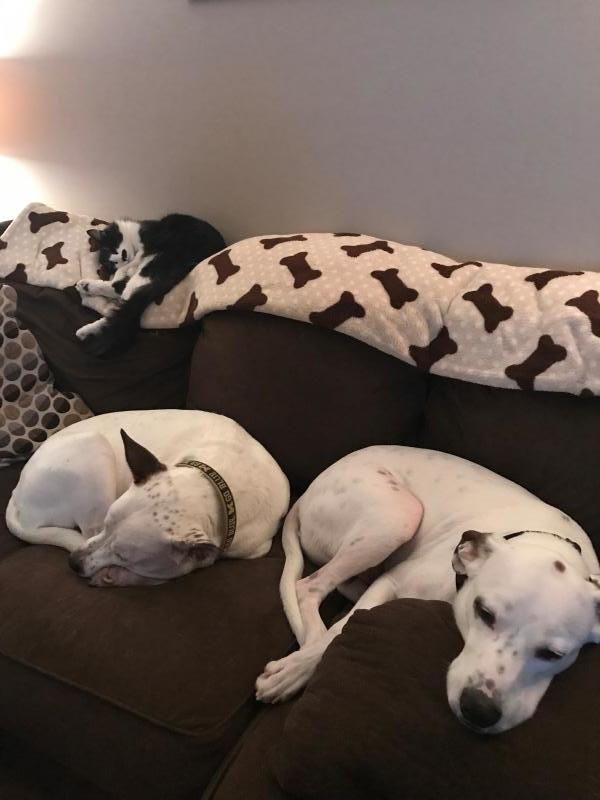
You are a GUI agent. You are given a task and a screenshot of the screen. Output one action in this format:
    pyautogui.click(x=<x>, y=<y>)
    Task: Click on the brown couch
    The height and width of the screenshot is (800, 600).
    Given the screenshot: What is the action you would take?
    pyautogui.click(x=301, y=406)